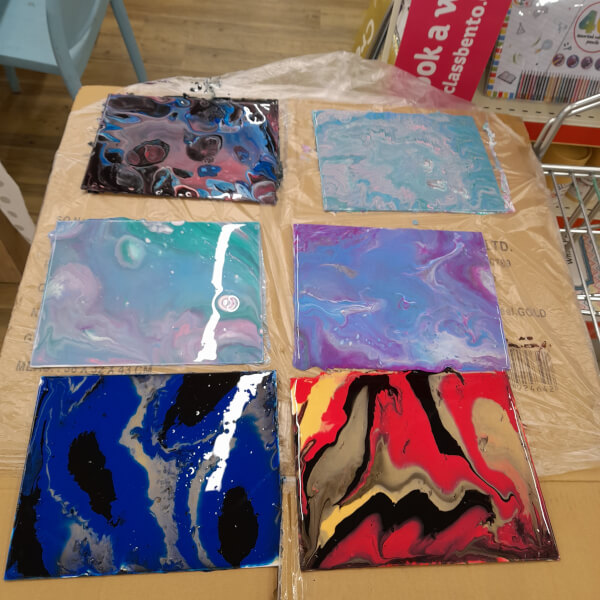
Where is `wooden floor`? wooden floor is located at coordinates (8, 274).